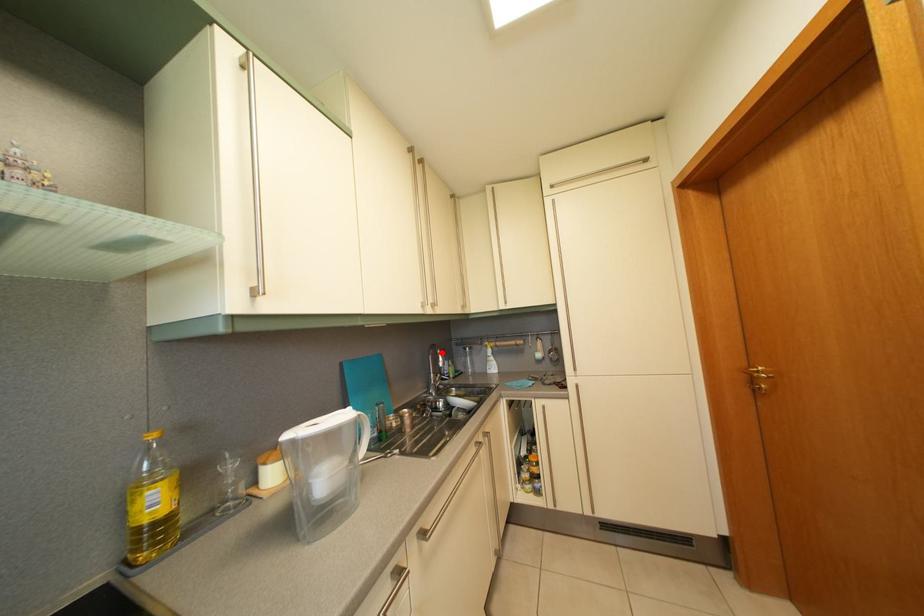
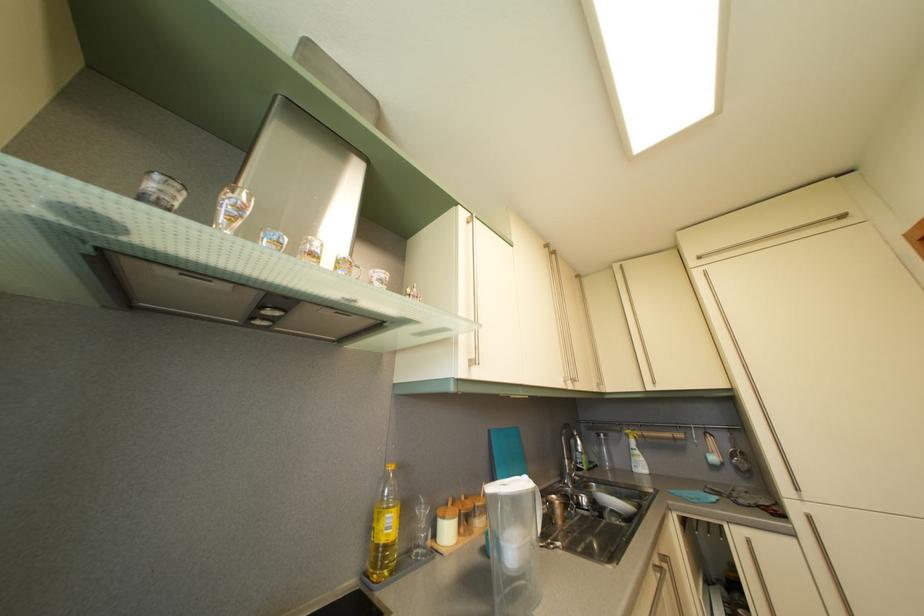
Question: I am providing you with two images of the same scene from different viewpoints. A red point is shown in image1. For the corresponding object point in image2, is it positioned nearer or farther from the camera?

Choices:
 (A) Nearer
 (B) Farther

Answer: (B)